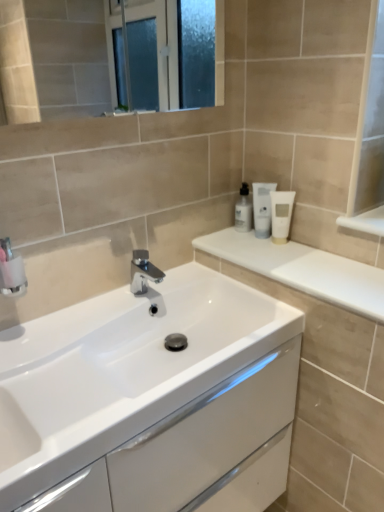
Identify the location of vacant area that is in front of white matte tube at upper right, which is the 3th toiletry in left-to-right order. (298, 266).